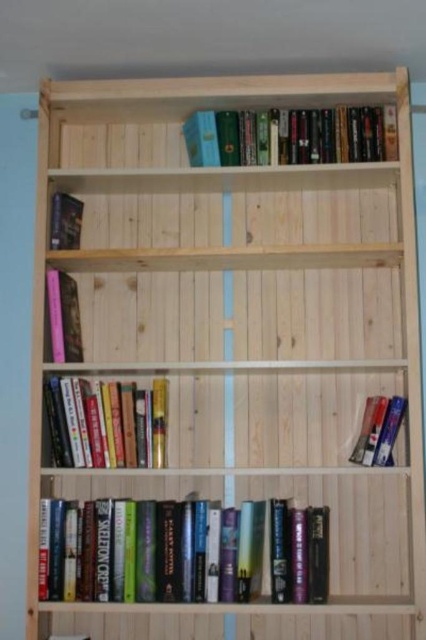
How distant is pink matte book at left from hardcover book at left?

A distance of 7.22 inches exists between pink matte book at left and hardcover book at left.

Does pink matte book at left have a greater height compared to hardcover book at left?

Correct, pink matte book at left is much taller as hardcover book at left.

Is point (69, 339) closer to camera compared to point (55, 248)?

Yes, point (69, 339) is in front of point (55, 248).

The image size is (426, 640). In order to click on pink matte book at left in this screenshot , I will do `click(63, 316)`.

Can you confirm if hardcover books at lower center is positioned to the left of pink matte book at left?

In fact, hardcover books at lower center is to the right of pink matte book at left.

Does point (97, 536) come closer to viewer compared to point (66, 332)?

Yes, point (97, 536) is in front of point (66, 332).

Find the location of a particular element. hardcover books at lower center is located at coordinates (149, 552).

Does hardcover books at lower center have a lesser height compared to hardcover book at left?

No, hardcover books at lower center is not shorter than hardcover book at left.

Based on the photo, who is more forward, (103, 596) or (74, 218)?

Point (103, 596) is more forward.

The image size is (426, 640). Identify the location of hardcover books at lower center. (149, 552).